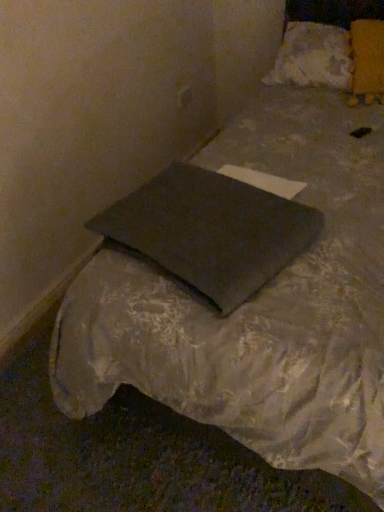
Question: From a real-world perspective, is dark gray fabric pillow at center, which is the first pillow from bottom to top, positioned above or below yellow fabric pillow at upper right, which is the 2th pillow from bottom to top?

Choices:
 (A) below
 (B) above

Answer: (A)

Question: Is dark gray fabric pillow at center, marked as the 3th pillow in a back-to-front arrangement, taller or shorter than yellow fabric pillow at upper right, which is counted as the 2th pillow, starting from the top?

Choices:
 (A) short
 (B) tall

Answer: (A)

Question: Estimate the real-world distances between objects in this image. Which object is farther from the dark gray fabric pillow at center, marked as the 1th pillow in a front-to-back arrangement?

Choices:
 (A) yellow fabric pillow at upper right, acting as the second pillow starting from the back
 (B) white fluffy pillow at upper right, which is the third pillow in bottom-to-top order

Answer: (B)

Question: Based on their relative distances, which object is nearer to the yellow fabric pillow at upper right, acting as the second pillow starting from the back?

Choices:
 (A) white fluffy pillow at upper right, which appears as the 3th pillow when viewed from the front
 (B) dark gray fabric pillow at center, positioned as the third pillow in top-to-bottom order

Answer: (A)